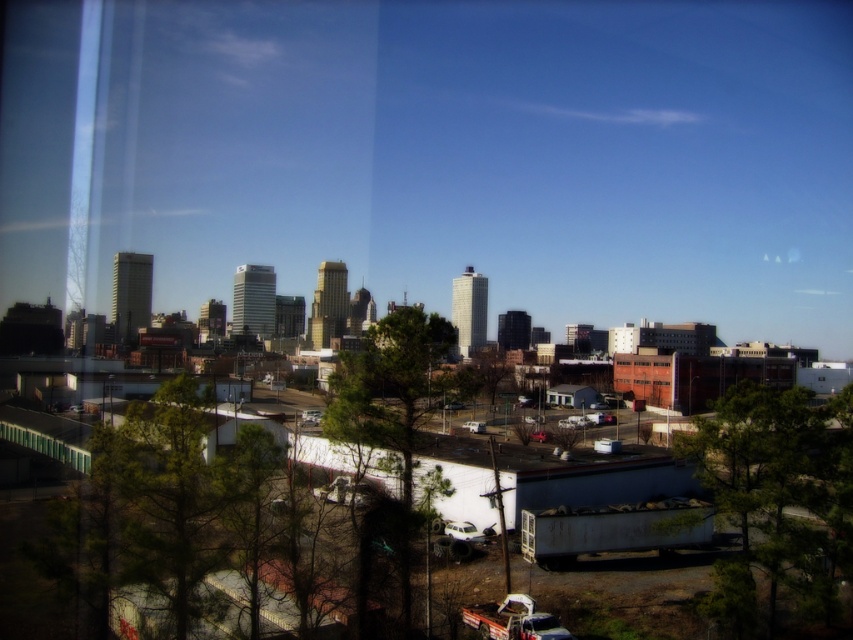
Question: Which point is closer to the camera taking this photo?

Choices:
 (A) (338, 419)
 (B) (778, 452)

Answer: (B)

Question: Is green matte tree at right further to camera compared to green leafy tree at center?

Choices:
 (A) no
 (B) yes

Answer: (B)

Question: Which object appears farthest from the camera in this image?

Choices:
 (A) green leafy tree at center
 (B) green matte tree at right

Answer: (B)

Question: Is green matte tree at right above green leafy tree at center?

Choices:
 (A) no
 (B) yes

Answer: (A)

Question: Considering the relative positions of green matte tree at right and green leafy tree at center in the image provided, where is green matte tree at right located with respect to green leafy tree at center?

Choices:
 (A) above
 (B) below

Answer: (B)